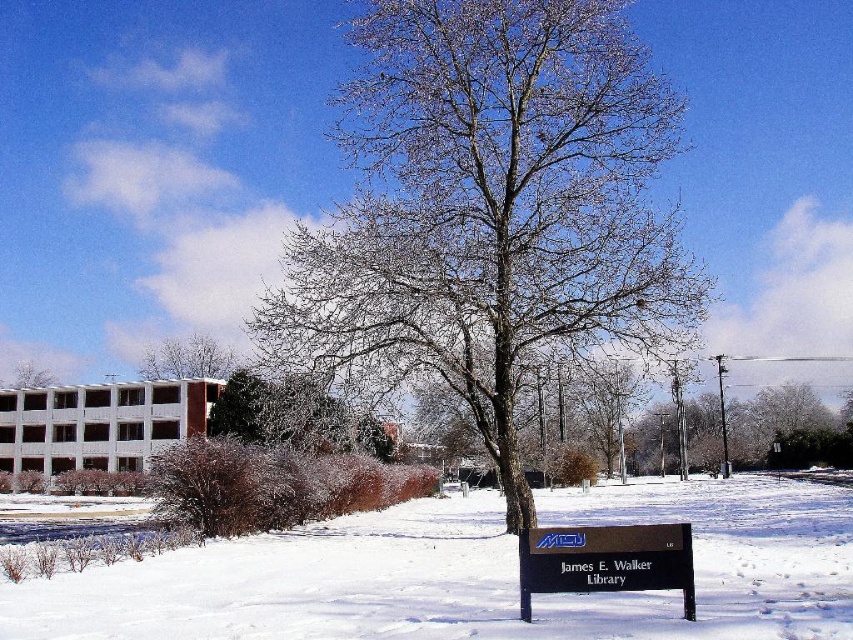
Can you confirm if snow-covered tree at center is wider than white fluffy snow at lower center?

Indeed, snow-covered tree at center has a greater width compared to white fluffy snow at lower center.

Does point (531, 248) come closer to viewer compared to point (434, 573)?

No, it is behind (434, 573).

Is point (608, 40) positioned after point (442, 520)?

No, (608, 40) is closer to viewer.

You are a GUI agent. You are given a task and a screenshot of the screen. Output one action in this format:
    pyautogui.click(x=<x>, y=<y>)
    Task: Click on the snow-covered tree at center
    Image resolution: width=853 pixels, height=640 pixels.
    Given the screenshot: What is the action you would take?
    pyautogui.click(x=490, y=205)

Is white fluffy snow at lower center to the left of bare branches at center from the viewer's perspective?

No, white fluffy snow at lower center is not to the left of bare branches at center.

Can you confirm if white fluffy snow at lower center is positioned to the right of bare branches at center?

Indeed, white fluffy snow at lower center is positioned on the right side of bare branches at center.

Describe the element at coordinates (473, 573) in the screenshot. The width and height of the screenshot is (853, 640). I see `white fluffy snow at lower center` at that location.

Find the location of a particular element. The width and height of the screenshot is (853, 640). white fluffy snow at lower center is located at coordinates (473, 573).

Locate an element on the screen. The width and height of the screenshot is (853, 640). snow-covered tree at center is located at coordinates (490, 205).

Does snow-covered tree at center appear on the right side of black plastic sign at lower center?

Yes, snow-covered tree at center is to the right of black plastic sign at lower center.

This screenshot has height=640, width=853. Find the location of `snow-covered tree at center`. snow-covered tree at center is located at coordinates (490, 205).

This screenshot has height=640, width=853. Identify the location of snow-covered tree at center. (490, 205).